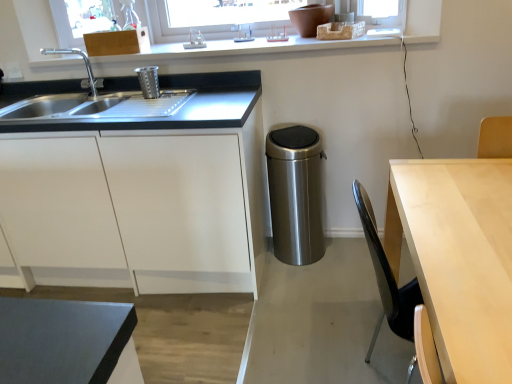
Question: Can you confirm if white plastic window frame at upper center is wider than brushed metal trash can at upper left, marked as the 1th appliance in a top-to-bottom arrangement?

Choices:
 (A) yes
 (B) no

Answer: (A)

Question: Is white plastic window frame at upper center outside of brushed metal trash can at upper left, which is the second appliance in right-to-left order?

Choices:
 (A) yes
 (B) no

Answer: (A)

Question: From a real-world perspective, is white plastic window frame at upper center beneath brushed metal trash can at upper left, which is the second appliance in right-to-left order?

Choices:
 (A) no
 (B) yes

Answer: (A)

Question: From a real-world perspective, is white plastic window frame at upper center over brushed metal trash can at upper left, marked as the 1th appliance in a top-to-bottom arrangement?

Choices:
 (A) no
 (B) yes

Answer: (B)

Question: Is white plastic window frame at upper center taller than brushed metal trash can at upper left, which is the second appliance in right-to-left order?

Choices:
 (A) no
 (B) yes

Answer: (A)

Question: In the image, is white plastic window frame at upper center on the left side or the right side of brushed metal faucet at left?

Choices:
 (A) right
 (B) left

Answer: (A)

Question: Do you think white plastic window frame at upper center is within brushed metal faucet at left, or outside of it?

Choices:
 (A) inside
 (B) outside

Answer: (B)

Question: Looking at their shapes, would you say white plastic window frame at upper center is wider or thinner than brushed metal faucet at left?

Choices:
 (A) thin
 (B) wide

Answer: (B)

Question: From their relative heights in the image, would you say white plastic window frame at upper center is taller or shorter than brushed metal faucet at left?

Choices:
 (A) tall
 (B) short

Answer: (B)

Question: From a real-world perspective, is brushed metal faucet at left positioned above or below stainless steel trash can at center, the second appliance viewed from the left?

Choices:
 (A) below
 (B) above

Answer: (B)

Question: Which is correct: brushed metal faucet at left is inside stainless steel trash can at center, the 2th appliance when ordered from top to bottom, or outside of it?

Choices:
 (A) inside
 (B) outside

Answer: (B)

Question: Based on their sizes in the image, would you say brushed metal faucet at left is bigger or smaller than stainless steel trash can at center, the 2th appliance when ordered from top to bottom?

Choices:
 (A) big
 (B) small

Answer: (B)

Question: Looking at their shapes, would you say brushed metal faucet at left is wider or thinner than stainless steel trash can at center, arranged as the first appliance when ordered from the bottom?

Choices:
 (A) thin
 (B) wide

Answer: (A)

Question: In terms of height, does white plastic window frame at upper center look taller or shorter compared to satin steel sink at left?

Choices:
 (A) tall
 (B) short

Answer: (B)

Question: In the image, is white plastic window frame at upper center positioned in front of or behind satin steel sink at left?

Choices:
 (A) front
 (B) behind

Answer: (B)